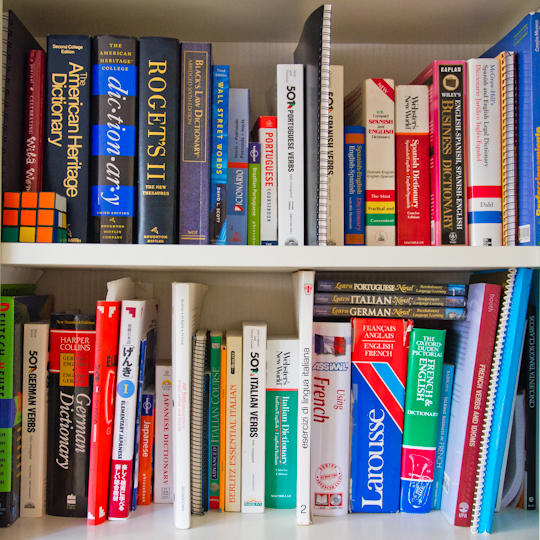
The width and height of the screenshot is (540, 540). I want to click on green books, so click(x=8, y=356), click(x=213, y=422), click(x=278, y=440), click(x=416, y=424), click(x=255, y=184).